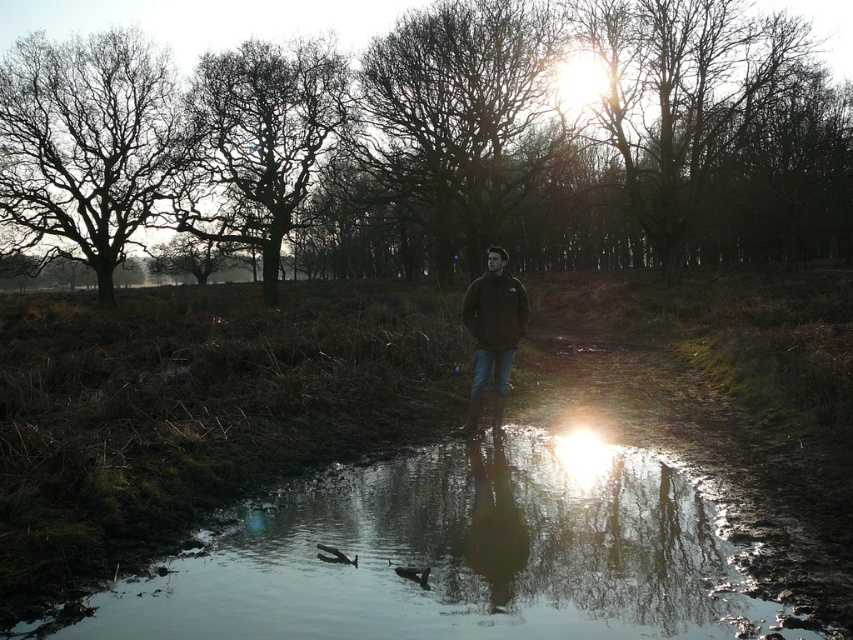
Which is more to the left, brown leafless tree at upper center or bare branches at center?

From the viewer's perspective, bare branches at center appears more on the left side.

Based on the photo, who is more distant from viewer, (598, 189) or (437, 115)?

The point (598, 189) is behind.

Does point (672, 237) come in front of point (416, 186)?

Yes, point (672, 237) is closer to viewer.

At what (x,y) coordinates should I click in order to perform the action: click on brown leafless tree at upper center. Please return your answer as a coordinate pair (x, y). Looking at the image, I should click on (579, 150).

Is bare branches at left positioned before dark brown feathers at lower center?

No.

Can you confirm if bare branches at left is positioned above dark brown feathers at lower center?

Correct, bare branches at left is located above dark brown feathers at lower center.

Measure the distance between point (161, 49) and camera.

Point (161, 49) and camera are 44.36 meters apart.

Where is `bare branches at left`? This screenshot has width=853, height=640. bare branches at left is located at coordinates (85, 145).

Is point (676, 525) positioned behind point (204, 93)?

That is False.

Does shiny reflective water at center have a greater width compared to dark brown bark tree at upper left?

No.

Between point (576, 627) and point (202, 58), which one is positioned behind?

The point (202, 58) is more distant.

The image size is (853, 640). I want to click on shiny reflective water at center, so click(x=526, y=531).